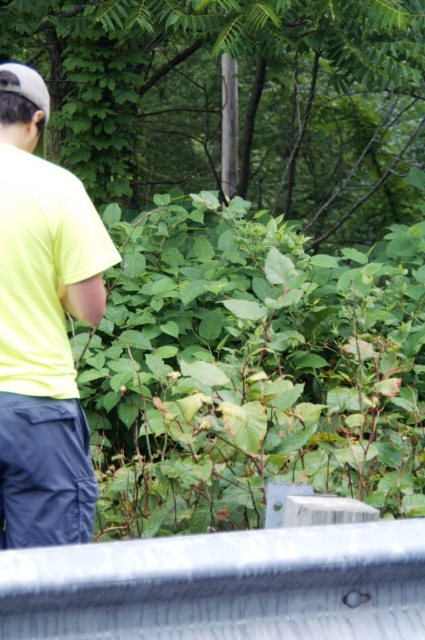
Is point (19, 604) closer to camera compared to point (39, 76)?

Yes.

Which of these two, metallic gray rail at lower center or white matte baseball cap at upper left, stands taller?

metallic gray rail at lower center is taller.

I want to click on metallic gray rail at lower center, so click(223, 586).

Find the location of a particular element. The width and height of the screenshot is (425, 640). metallic gray rail at lower center is located at coordinates (223, 586).

This screenshot has width=425, height=640. What are the coordinates of `yellow matte shirt at left` in the screenshot? It's located at (42, 324).

Describe the element at coordinates (42, 324) in the screenshot. I see `yellow matte shirt at left` at that location.

Image resolution: width=425 pixels, height=640 pixels. What are the coordinates of `yellow matte shirt at left` in the screenshot? It's located at (42, 324).

Measure the distance from metallic gray rail at lower center to yellow matte shirt at left.

The distance of metallic gray rail at lower center from yellow matte shirt at left is 37.90 inches.

Does metallic gray rail at lower center have a smaller size compared to yellow matte shirt at left?

Indeed, metallic gray rail at lower center has a smaller size compared to yellow matte shirt at left.

Locate an element on the screen. The width and height of the screenshot is (425, 640). metallic gray rail at lower center is located at coordinates (223, 586).